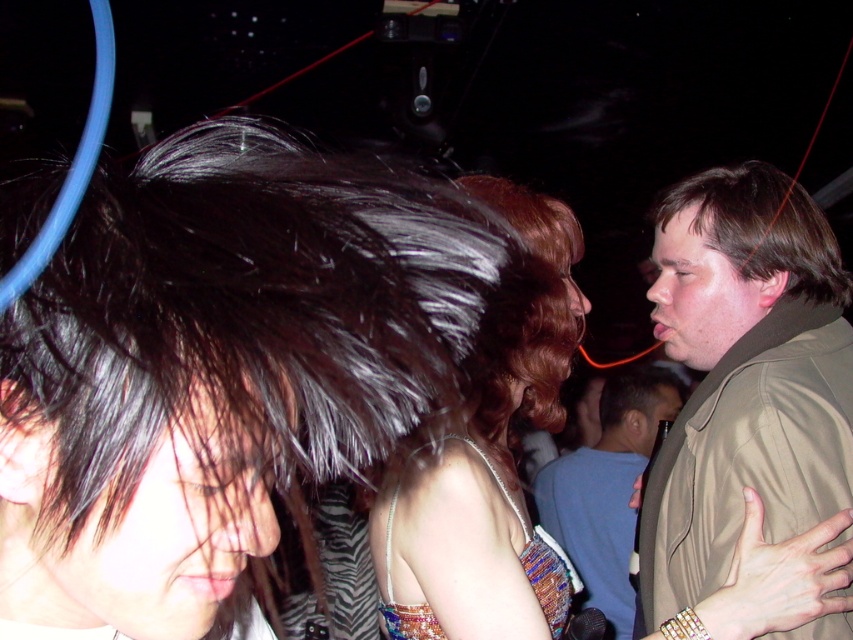
You are a photographer at a party. You want to take a photo of the shiny black hair at center and the light blue shirt at center. Can you adjust your camera angle so that both are fully visible without one blocking the other?

The shiny black hair at center is in front of the light blue shirt at center, so adjusting the camera angle might allow both to be visible if you move to a position where the shiny black hair at center is no longer directly blocking the light blue shirt at center.

In the scene shown: You are at a party and want to take a photo of the shiny metallic dress at center and the light blue shirt at center. Which one should you focus on first if you want to capture both clearly in the same frame?

The shiny metallic dress at center is above the light blue shirt at center, so you should focus on the light blue shirt at center first as it is lower and might be in the foreground, ensuring both are in focus.